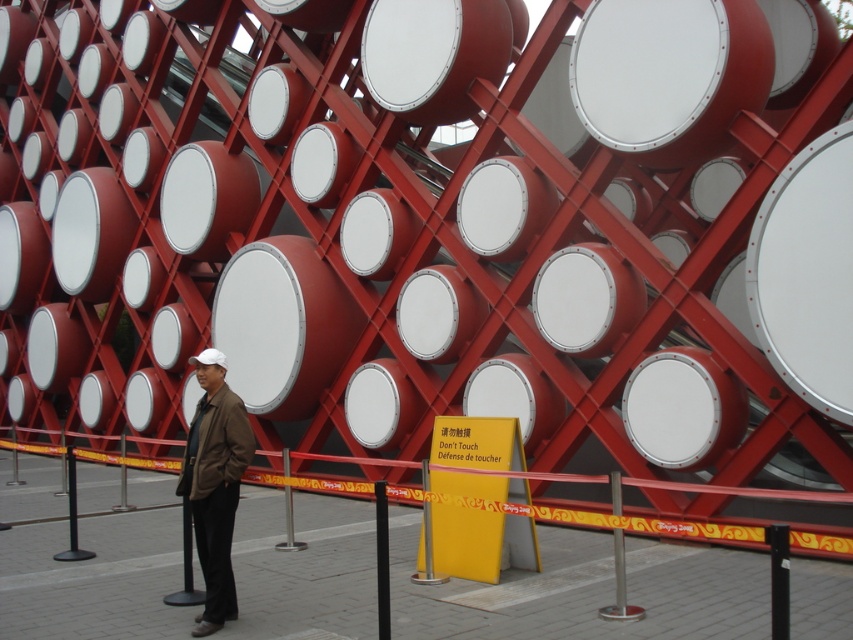
Is brown leather jacket at center to the right of white matte drum at center from the viewer's perspective?

No, brown leather jacket at center is not to the right of white matte drum at center.

Does brown leather jacket at center come in front of white matte drum at center?

Yes, brown leather jacket at center is in front of white matte drum at center.

Who is more distant from viewer, (239, 480) or (679, 456)?

The point (679, 456) is more distant.

Locate an element on the screen. The image size is (853, 640). brown leather jacket at center is located at coordinates (213, 483).